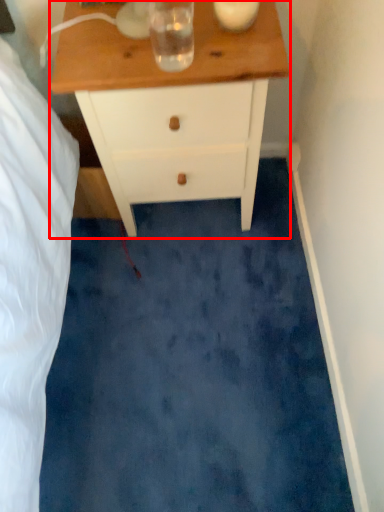
Question: Observing the image, what is the correct spatial positioning of chest of drawers (annotated by the red box) in reference to beverage?

Choices:
 (A) left
 (B) right

Answer: (B)